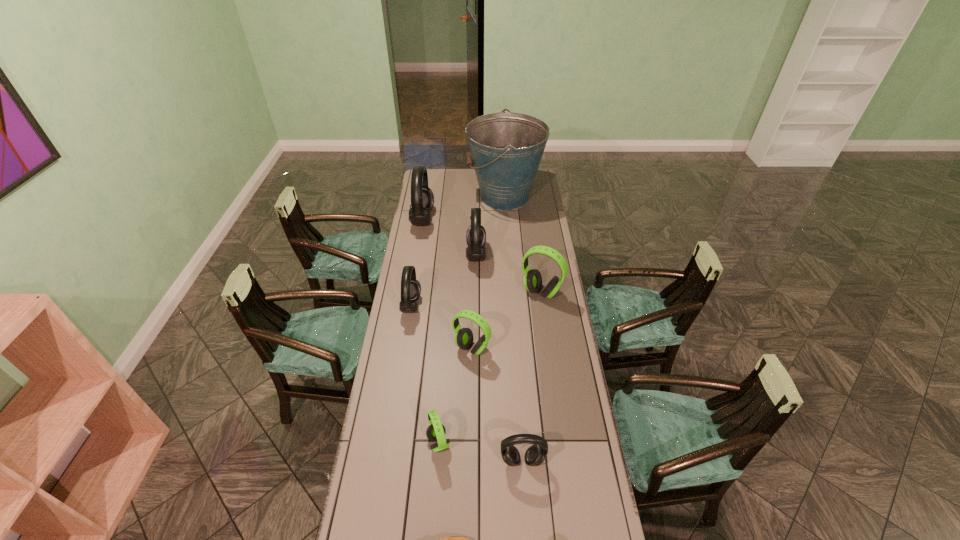
I want to click on the smallest green headset, so click(436, 431).

Find the location of a particular element. The image size is (960, 540). the nearest gray headset is located at coordinates (535, 455).

This screenshot has height=540, width=960. I want to click on the rightmost gray headset, so click(x=535, y=455).

Identify the location of free space located 0.260m with the handle on opposite sides of the bucket. (423, 197).

The image size is (960, 540). Find the location of `free spot located with the handle on opposite sides of the bucket`. free spot located with the handle on opposite sides of the bucket is located at coordinates (453, 197).

Find the location of `free space located 0.060m with the handle on opposite sides of the bucket`. free space located 0.060m with the handle on opposite sides of the bucket is located at coordinates point(457,197).

What are the coordinates of `vacant space located 0.230m on the earcups of the biggest gray headset` in the screenshot? It's located at (475, 219).

Locate an element on the screen. This screenshot has height=540, width=960. free space located on the earcups of the third farthest object is located at coordinates (543, 255).

You are a GUI agent. You are given a task and a screenshot of the screen. Output one action in this format:
    pyautogui.click(x=<x>, y=<y>)
    Task: Click on the vacant space situated 0.340m on the left of the biggest green headset
    The height and width of the screenshot is (540, 960).
    Given the screenshot: What is the action you would take?
    pyautogui.click(x=446, y=292)

Where is `free location located on the earcups of the second nearest gray headset`? The image size is (960, 540). free location located on the earcups of the second nearest gray headset is located at coordinates (447, 306).